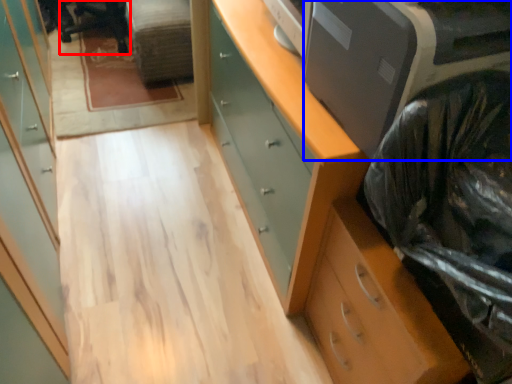
Question: Which point is closer to the camera, computer chair (highlighted by a red box) or printer (highlighted by a blue box)?

Choices:
 (A) computer chair
 (B) printer

Answer: (B)